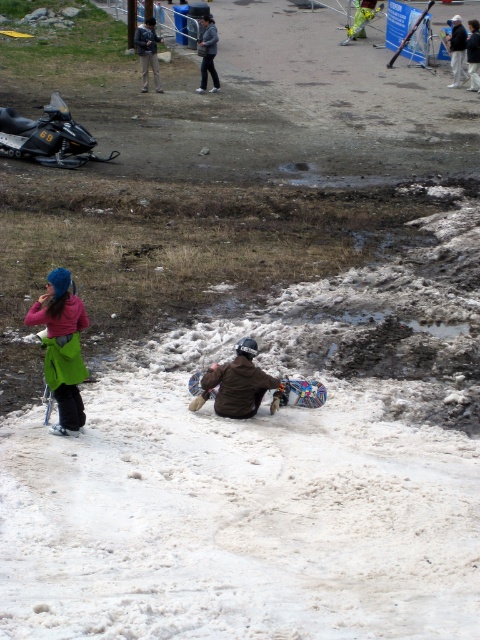
You are a drone operator trying to capture a photo of the brown suede snowboarder at center. The camera is currently positioned at point A, which is at coordinates 0.5, 0.5. To get the best shot, you need to adjust the camera to the snowboarder. Which direction should you move the camera horizontally and vertically?

The brown suede snowboarder at center is located at coordinates (236, 384). Since the camera is at (240, 320), you should move the camera horizontally to the right and slightly downward to align with the snowboarder.